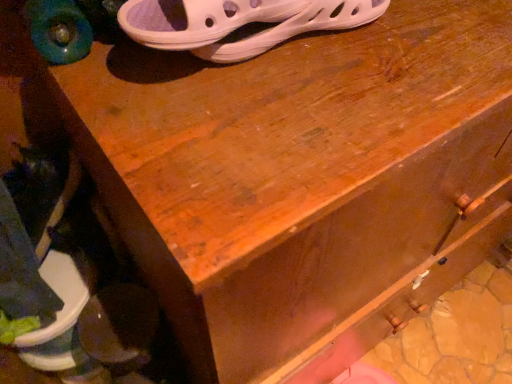
Question: Relative to dark brown leather shoe at lower left, placed as the 2th footwear when sorted from right to left, is white mesh sandal at upper center, which is the 1th footwear from top to bottom, in front or behind?

Choices:
 (A) behind
 (B) front

Answer: (B)

Question: Is point (208, 44) positioned closer to the camera than point (67, 266)?

Choices:
 (A) closer
 (B) farther

Answer: (A)

Question: From the image's perspective, is white mesh sandal at upper center, which is counted as the 2th footwear, starting from the back, above or below dark brown leather shoe at lower left, acting as the 2th footwear starting from the top?

Choices:
 (A) above
 (B) below

Answer: (A)

Question: In terms of width, does dark brown leather shoe at lower left, acting as the 2th footwear starting from the top, look wider or thinner when compared to white mesh sandal at upper center, arranged as the 2th footwear when ordered from the bottom?

Choices:
 (A) thin
 (B) wide

Answer: (B)

Question: Do you think dark brown leather shoe at lower left, the 2th footwear in the front-to-back sequence, is within white mesh sandal at upper center, which is counted as the 2th footwear, starting from the back, or outside of it?

Choices:
 (A) inside
 (B) outside

Answer: (B)

Question: From their relative heights in the image, would you say dark brown leather shoe at lower left, the 2th footwear in the front-to-back sequence, is taller or shorter than white mesh sandal at upper center, which is counted as the 2th footwear, starting from the back?

Choices:
 (A) tall
 (B) short

Answer: (A)

Question: Based on their positions, is dark brown leather shoe at lower left, which is the first footwear in bottom-to-top order, located to the left or right of white mesh sandal at upper center, which is the 1th footwear from right to left?

Choices:
 (A) right
 (B) left

Answer: (B)